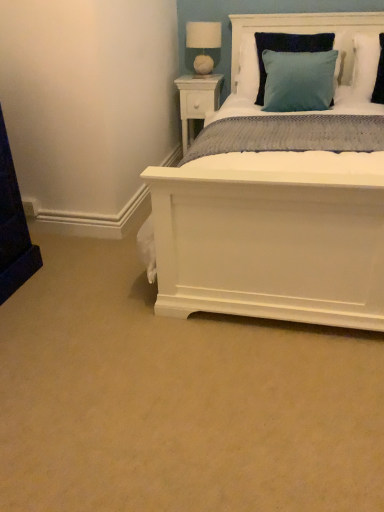
Question: In which direction should I rotate to look at white fabric-covered lampshade at upper center?

Choices:
 (A) left
 (B) right

Answer: (B)

Question: Is the position of teal velvet pillow at upper right, which appears as the 1th pillow when viewed from the left, more distant than that of white wood nightstand at upper center?

Choices:
 (A) yes
 (B) no

Answer: (B)

Question: Are teal velvet pillow at upper right, which appears as the 1th pillow when viewed from the left, and white wood nightstand at upper center beside each other?

Choices:
 (A) yes
 (B) no

Answer: (B)

Question: Is teal velvet pillow at upper right, which appears as the 1th pillow when viewed from the left, not close to white wood nightstand at upper center?

Choices:
 (A) yes
 (B) no

Answer: (B)

Question: Is the depth of teal velvet pillow at upper right, placed as the second pillow when sorted from right to left, less than that of white wood nightstand at upper center?

Choices:
 (A) no
 (B) yes

Answer: (B)

Question: From the image's perspective, is teal velvet pillow at upper right, placed as the second pillow when sorted from right to left, on white wood nightstand at upper center?

Choices:
 (A) no
 (B) yes

Answer: (A)

Question: From a real-world perspective, is teal velvet pillow at upper right, placed as the second pillow when sorted from right to left, positioned under white wood nightstand at upper center based on gravity?

Choices:
 (A) yes
 (B) no

Answer: (B)

Question: Can you confirm if teal fabric pillow at upper right, positioned as the first pillow in right-to-left order, is smaller than white wood headboard at upper center?

Choices:
 (A) yes
 (B) no

Answer: (A)

Question: Is teal fabric pillow at upper right, placed as the 2th pillow when sorted from left to right, looking in the opposite direction of white wood headboard at upper center?

Choices:
 (A) yes
 (B) no

Answer: (B)

Question: Can you confirm if teal fabric pillow at upper right, positioned as the first pillow in right-to-left order, is bigger than white wood headboard at upper center?

Choices:
 (A) no
 (B) yes

Answer: (A)

Question: Does teal fabric pillow at upper right, positioned as the first pillow in right-to-left order, appear on the left side of white wood headboard at upper center?

Choices:
 (A) yes
 (B) no

Answer: (B)

Question: Does teal fabric pillow at upper right, placed as the 2th pillow when sorted from left to right, have a lesser height compared to white wood headboard at upper center?

Choices:
 (A) no
 (B) yes

Answer: (B)

Question: From a real-world perspective, is teal fabric pillow at upper right, placed as the 2th pillow when sorted from left to right, beneath white wood headboard at upper center?

Choices:
 (A) no
 (B) yes

Answer: (A)

Question: Can you confirm if teal fabric pillow at upper right, positioned as the first pillow in right-to-left order, is smaller than teal velvet pillow at upper right, placed as the second pillow when sorted from right to left?

Choices:
 (A) yes
 (B) no

Answer: (A)